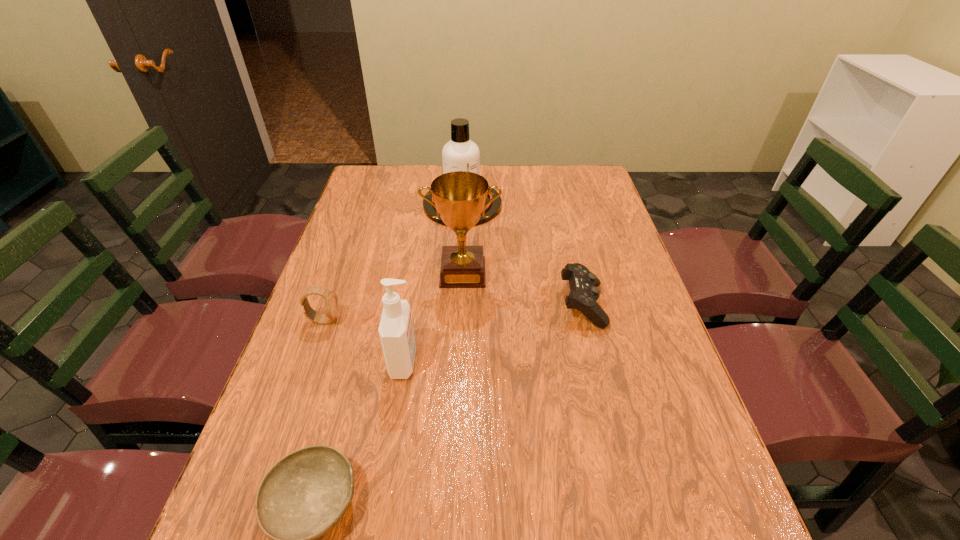
Identify the location of free spot between the fourth tallest object and the nearer cleansing agent. click(364, 341).

Image resolution: width=960 pixels, height=540 pixels. In order to click on free area in between the second nearest object and the award in this screenshot , I will do `click(433, 318)`.

Identify the location of free space between the second nearest object and the control. click(493, 333).

Find the location of `unoccupied position between the watch and the rightmost object`. unoccupied position between the watch and the rightmost object is located at coordinates (453, 313).

Where is `object that is the closest to the nearest object`? Image resolution: width=960 pixels, height=540 pixels. object that is the closest to the nearest object is located at coordinates (396, 332).

Identify the location of object that ranks as the third closest to the farther cleansing agent. This screenshot has height=540, width=960. (331, 301).

Locate an element on the screen. The width and height of the screenshot is (960, 540). free space that satisfies the following two spatial constraints: 1. on the plaque of the award; 2. on the right side of the control is located at coordinates (462, 305).

I want to click on free space that satisfies the following two spatial constraints: 1. on the plaque of the award; 2. on the face of the watch, so click(x=461, y=320).

At what (x,y) coordinates should I click in order to perform the action: click on free space that satisfies the following two spatial constraints: 1. on the front side of the farthest object; 2. on the face of the watch. Please return your answer as a coordinate pair (x, y). Looking at the image, I should click on (456, 320).

In order to click on vacant region that satisfies the following two spatial constraints: 1. on the plaque of the award; 2. on the front label of the nearer cleansing agent in this screenshot , I will do `click(459, 362)`.